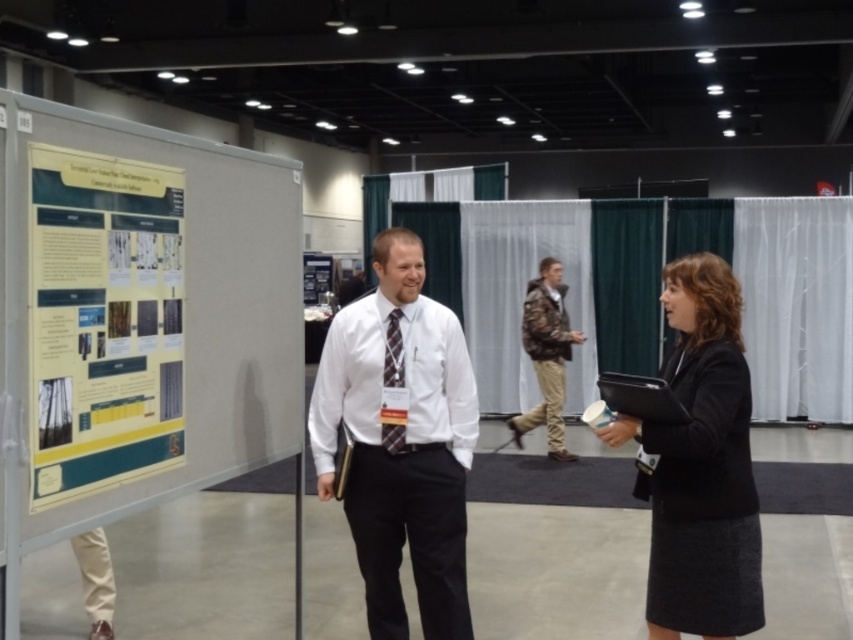
You are standing at the entrance of the conference hall and see the black wool skirt at right and the camouflage jacket at center. Which object is nearer to you?

The black wool skirt at right is closer to the viewer than the camouflage jacket at center.

Consider the image. You are organizing a photo shoot and need to ensure that the yellow paper poster at left and the camouflage jacket at center are both visible in the frame. Given their sizes, which object might require you to adjust the camera angle to include it fully?

The camouflage jacket at center requires adjusting the camera angle because it has a greater width than the yellow paper poster at left.